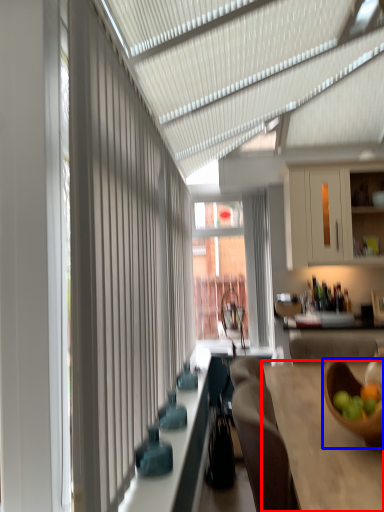
Question: Which point is closer to the camera, table (highlighted by a red box) or bowl (highlighted by a blue box)?

Choices:
 (A) table
 (B) bowl

Answer: (A)